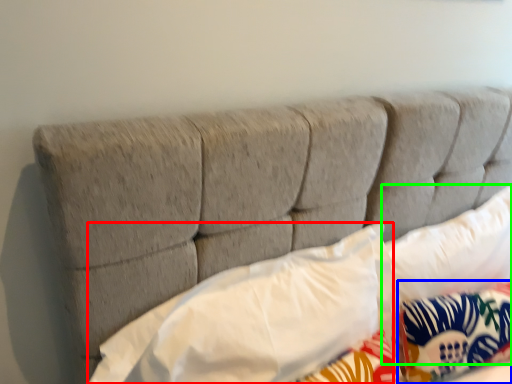
Question: Considering the real-world distances, which object is closest to pillow (highlighted by a red box)? pillow (highlighted by a blue box) or pillow (highlighted by a green box).

Choices:
 (A) pillow
 (B) pillow

Answer: (A)